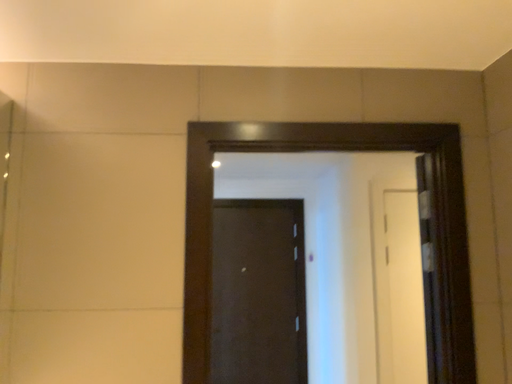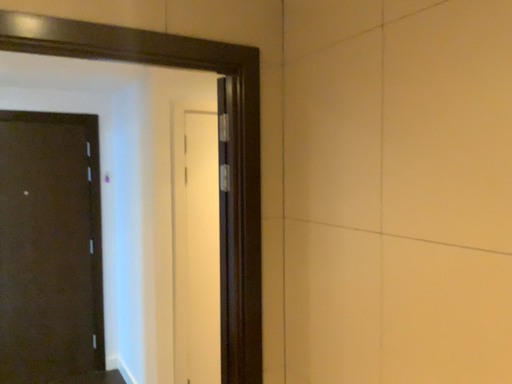
Question: Which way did the camera rotate in the video?

Choices:
 (A) rotated left
 (B) rotated right

Answer: (B)